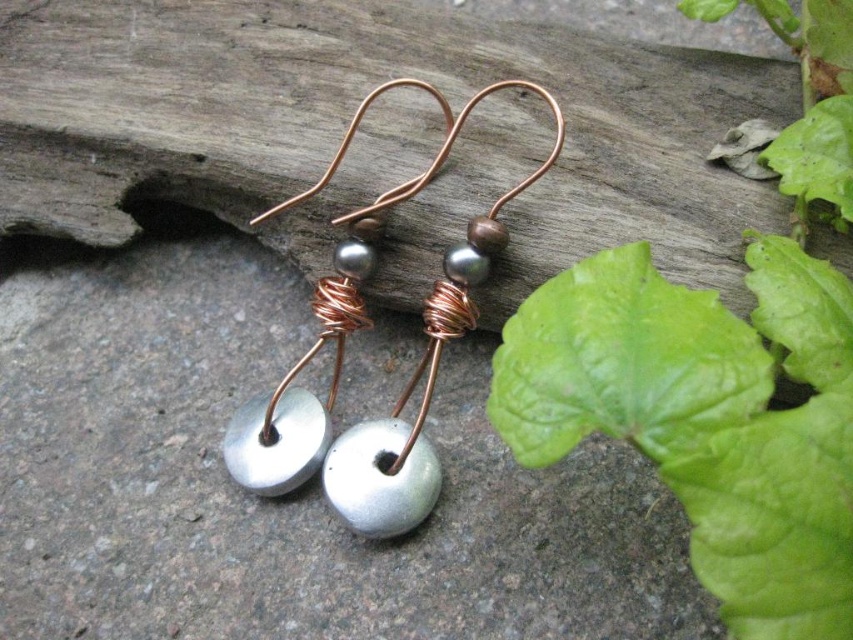
Measure the distance between point (x=236, y=465) and camera.

Point (x=236, y=465) is 4.38 feet from camera.

Is matte silver bead at center bigger than metallic silver bead at center?

Yes, matte silver bead at center is bigger than metallic silver bead at center.

This screenshot has width=853, height=640. Identify the location of matte silver bead at center. (341, 358).